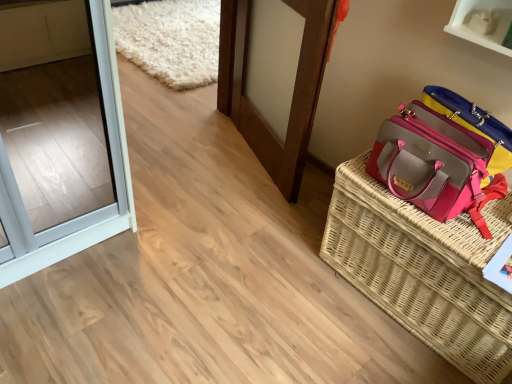
Where is `vacant area to the left of pink woven picnic basket at right`? This screenshot has width=512, height=384. vacant area to the left of pink woven picnic basket at right is located at coordinates (275, 278).